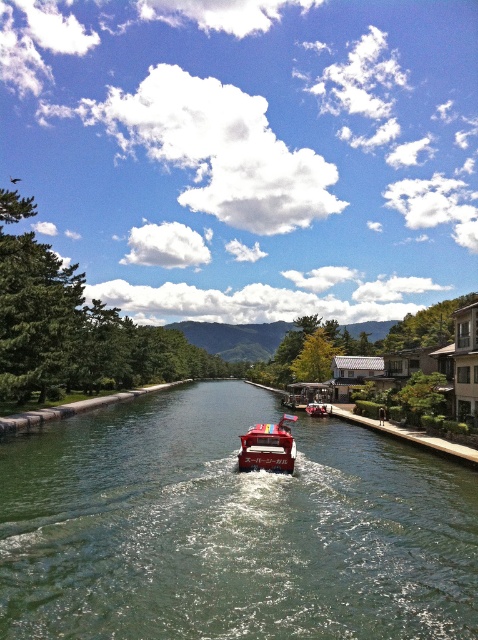
You are standing at the edge of the canal and want to reach a point exactly 10 meters away from where you are currently standing. The point you need to reach is marked as point [347,620]. Based on the scene description, can you determine if this point is within your target distance of 10 meters?

The distance between point [347,620] and the viewer is 13.42 meters, which is farther than the 10 meters target distance. Therefore, the point is not within your target distance.

You are standing on the bank of the canal and see the green glossy water at center and the red glossy boat at center. Which object is nearer to you?

The green glossy water at center is closer to the viewer than the red glossy boat at center, so the green glossy water at center is nearer to you.

You are standing on the bank of the canal and want to take a photo of the metallic red boat at center. Which direction should you turn your camera to capture it?

The metallic red boat at center is located at point coordinates of (268, 448), so you should aim your camera towards the center of the canal to capture it.